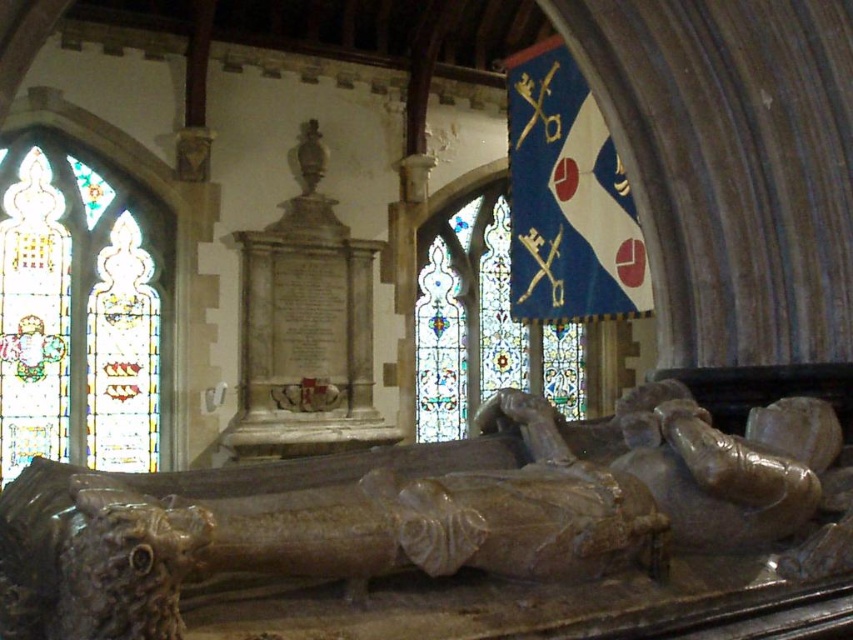
Can you confirm if brown polished stone effigy at lower center is wider than blue stained glass at upper center?

Correct, the width of brown polished stone effigy at lower center exceeds that of blue stained glass at upper center.

Does brown polished stone effigy at lower center appear on the right side of blue stained glass at upper center?

No, brown polished stone effigy at lower center is not to the right of blue stained glass at upper center.

At what (x,y) coordinates should I click in order to perform the action: click on brown polished stone effigy at lower center. Please return your answer as a coordinate pair (x, y). Image resolution: width=853 pixels, height=640 pixels. Looking at the image, I should click on (426, 509).

Which is above, brown polished stone effigy at lower center or stained glass window at left?

Positioned higher is stained glass window at left.

Based on the photo, is brown polished stone effigy at lower center shorter than stained glass window at left?

Yes, brown polished stone effigy at lower center is shorter than stained glass window at left.

This screenshot has height=640, width=853. In order to click on brown polished stone effigy at lower center in this screenshot , I will do `click(426, 509)`.

You are a GUI agent. You are given a task and a screenshot of the screen. Output one action in this format:
    pyautogui.click(x=<x>, y=<y>)
    Task: Click on the stained glass window at left
    The image size is (853, 640).
    Given the screenshot: What is the action you would take?
    pyautogui.click(x=80, y=310)

Does stained glass window at left have a greater width compared to blue stained glass at upper center?

In fact, stained glass window at left might be narrower than blue stained glass at upper center.

This screenshot has width=853, height=640. Describe the element at coordinates (80, 310) in the screenshot. I see `stained glass window at left` at that location.

Locate an element on the screen. This screenshot has width=853, height=640. stained glass window at left is located at coordinates (80, 310).